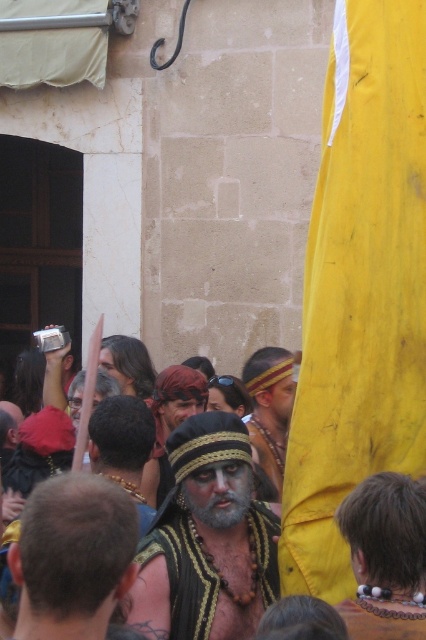
You are a photographer at the festival and want to capture both the black textured fabric at center and the beige leather necklace at lower right in a single frame. Which object should you focus on to ensure both are in the shot without zooming in too much?

Focus on the black textured fabric at center because it might be wider than the beige leather necklace at lower right, so keeping it centered will likely include both objects in the frame.

You are a photographer at the festival trying to capture a clear shot of the black textured fabric at center and the graywoollybeard at center. Which object is blocking the view of the other?

The black textured fabric at center is in front of the graywoollybeard at center, so it is blocking the view of the graywoollybeard at center.